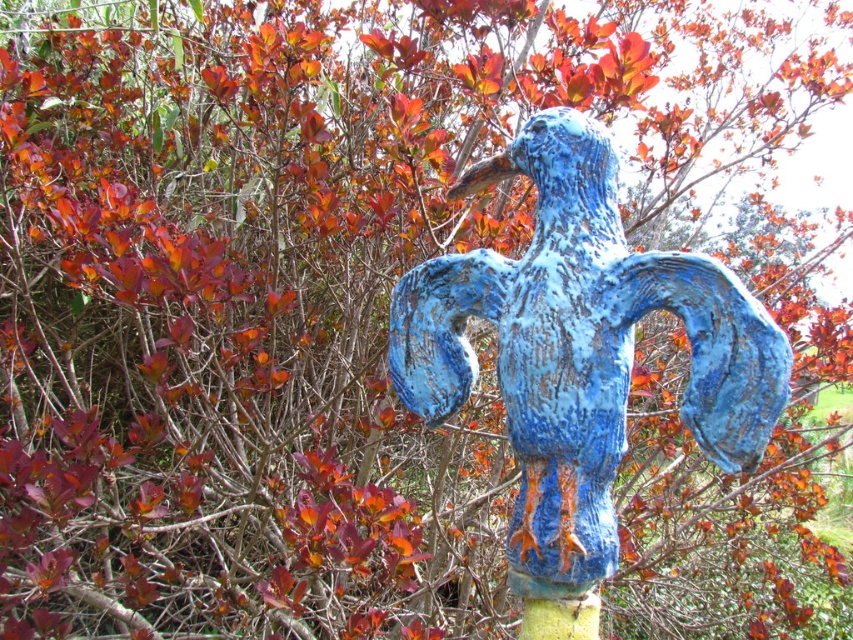
Is the position of blue chipped paint bird at center less distant than that of green mossy pole at center?

Yes.

Which is in front, point (688, 301) or point (549, 634)?

Point (688, 301) is more forward.

Identify the location of blue chipped paint bird at center. The image size is (853, 640). (579, 349).